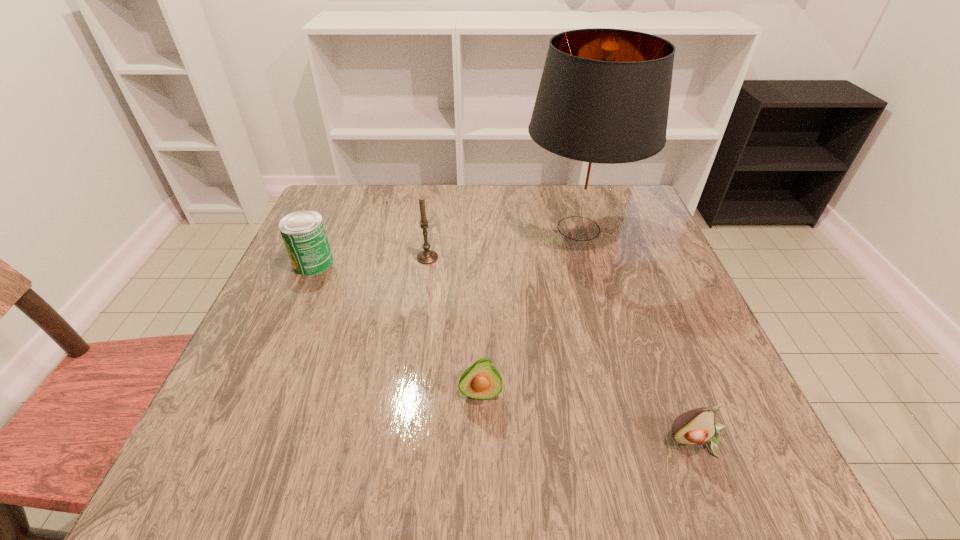
The image size is (960, 540). I want to click on lampshade, so click(x=602, y=105).

Find the location of a particular element. the fourth object from right to left is located at coordinates (427, 256).

The width and height of the screenshot is (960, 540). In order to click on the fourth shortest object in this screenshot , I will do `click(427, 256)`.

Image resolution: width=960 pixels, height=540 pixels. Identify the location of can. (303, 232).

Find the location of a particular element. This screenshot has width=960, height=540. the second nearest object is located at coordinates (481, 380).

Image resolution: width=960 pixels, height=540 pixels. Identify the location of the third object from left to right. (481, 380).

Where is `the nearer avocado`? the nearer avocado is located at coordinates (697, 426).

This screenshot has height=540, width=960. Find the location of `the right avocado`. the right avocado is located at coordinates (697, 426).

This screenshot has height=540, width=960. I want to click on vacant region located on the left of the tallest object, so click(x=448, y=228).

Locate an element on the screen. The height and width of the screenshot is (540, 960). free space located on the front of the second tallest object is located at coordinates (419, 325).